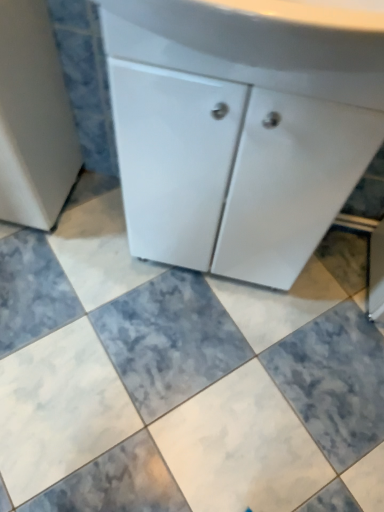
Question: Considering the relative sizes of white glossy cabinet at center and white glossy cabinet at upper center in the image provided, is white glossy cabinet at center wider than white glossy cabinet at upper center?

Choices:
 (A) yes
 (B) no

Answer: (B)

Question: Would you say white glossy cabinet at center contains white glossy cabinet at upper center?

Choices:
 (A) yes
 (B) no

Answer: (B)

Question: Are white glossy cabinet at center and white glossy cabinet at upper center far apart?

Choices:
 (A) yes
 (B) no

Answer: (B)

Question: Is white glossy cabinet at center looking in the opposite direction of white glossy cabinet at upper center?

Choices:
 (A) no
 (B) yes

Answer: (A)

Question: From the image's perspective, is white glossy cabinet at center beneath white glossy cabinet at upper center?

Choices:
 (A) yes
 (B) no

Answer: (A)

Question: Would you say white glossy cabinet at upper center is inside or outside marble tile at center?

Choices:
 (A) inside
 (B) outside

Answer: (B)

Question: Is white glossy cabinet at upper center taller or shorter than marble tile at center?

Choices:
 (A) tall
 (B) short

Answer: (A)

Question: From a real-world perspective, is white glossy cabinet at upper center physically located above or below marble tile at center?

Choices:
 (A) above
 (B) below

Answer: (A)

Question: Based on their sizes in the image, would you say white glossy cabinet at upper center is bigger or smaller than marble tile at center?

Choices:
 (A) big
 (B) small

Answer: (B)

Question: Is marble tile at center taller or shorter than white glossy cabinet at upper center?

Choices:
 (A) tall
 (B) short

Answer: (B)

Question: Visually, is marble tile at center positioned to the left or to the right of white glossy cabinet at upper center?

Choices:
 (A) left
 (B) right

Answer: (A)

Question: In the image, is marble tile at center positioned in front of or behind white glossy cabinet at upper center?

Choices:
 (A) front
 (B) behind

Answer: (B)

Question: From a real-world perspective, relative to white glossy cabinet at upper center, is marble tile at center vertically above or below?

Choices:
 (A) above
 (B) below

Answer: (B)

Question: Looking at their shapes, would you say white glossy cabinet at center is wider or thinner than marble tile at center?

Choices:
 (A) thin
 (B) wide

Answer: (A)

Question: Considering their positions, is white glossy cabinet at center located in front of or behind marble tile at center?

Choices:
 (A) front
 (B) behind

Answer: (A)